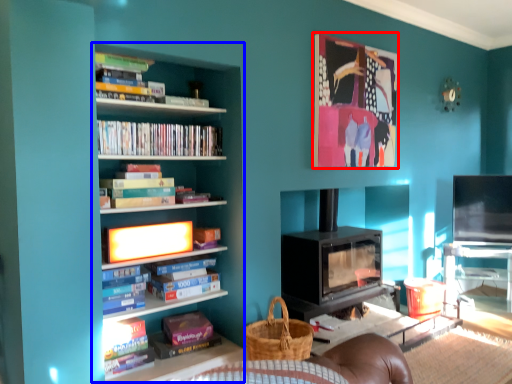
Question: Which object appears closest to the camera in this image, picture frame (highlighted by a red box) or bookcase (highlighted by a blue box)?

Choices:
 (A) picture frame
 (B) bookcase

Answer: (B)